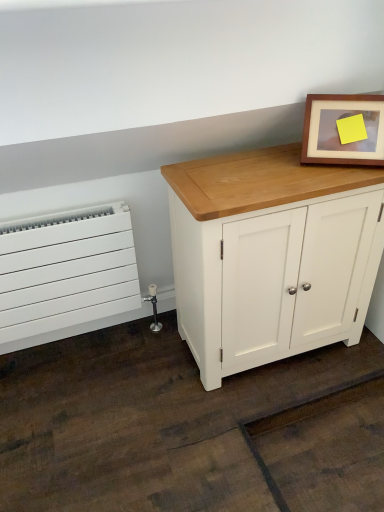
This screenshot has width=384, height=512. In order to click on vacant region below white matte radiator at left (from a real-world perspective) in this screenshot , I will do `click(82, 345)`.